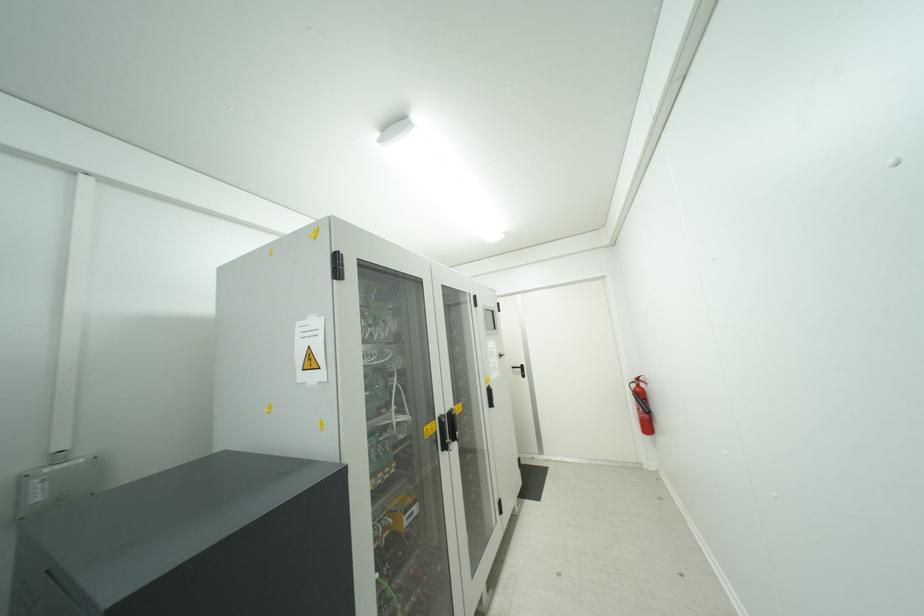
Locate an element on the screen. red fire extinguisher is located at coordinates (641, 405).